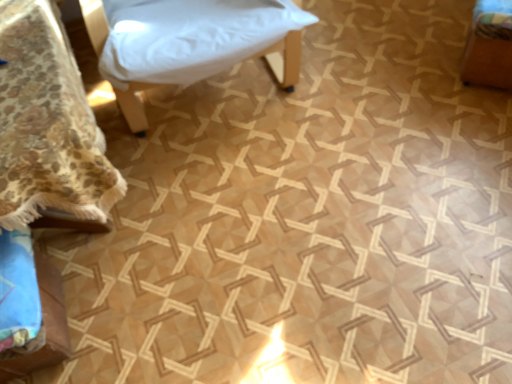
The width and height of the screenshot is (512, 384). I want to click on free location to the right of floral fabric bedspread at lower left, which ranks as the first furniture in left-to-right order, so click(303, 173).